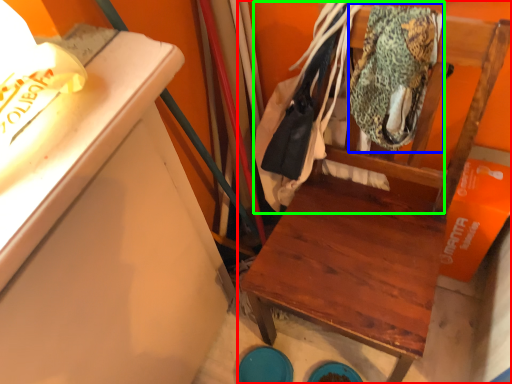
Question: Which object is positioned closest to furniture (highlighted by a red box)? Select from clothing (highlighted by a blue box) and laundry (highlighted by a green box).

Choices:
 (A) clothing
 (B) laundry

Answer: (A)